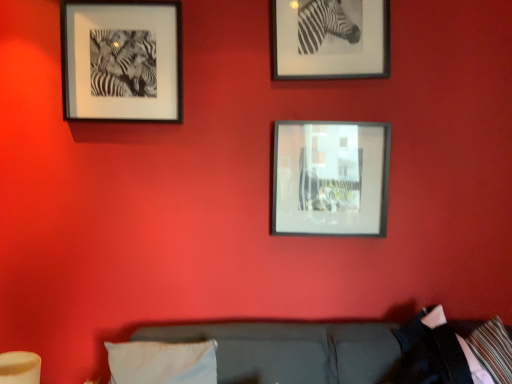
Question: From a real-world perspective, is metallic silver frame at center, arranged as the third picture frame when viewed from the left, above or below white fabric pillow at lower center?

Choices:
 (A) below
 (B) above

Answer: (B)

Question: Considering the relative positions of metallic silver frame at center, the 1th picture frame positioned from the right, and white fabric pillow at lower center in the image provided, is metallic silver frame at center, the 1th picture frame positioned from the right, to the left or to the right of white fabric pillow at lower center?

Choices:
 (A) left
 (B) right

Answer: (B)

Question: Which of these objects is positioned closest to the metallic silver frame at center, arranged as the third picture frame when viewed from the left?

Choices:
 (A) white fabric pillow at lower center
 (B) black matte picture frame at upper left, which is the 3th picture frame from right to left
 (C) metallic silver frame at upper right, the 2th picture frame from the right

Answer: (C)

Question: Which object is positioned closest to the metallic silver frame at upper right, marked as the second picture frame in a left-to-right arrangement?

Choices:
 (A) white fabric pillow at lower center
 (B) metallic silver frame at center, arranged as the third picture frame when viewed from the left
 (C) black matte picture frame at upper left, acting as the first picture frame starting from the left

Answer: (B)